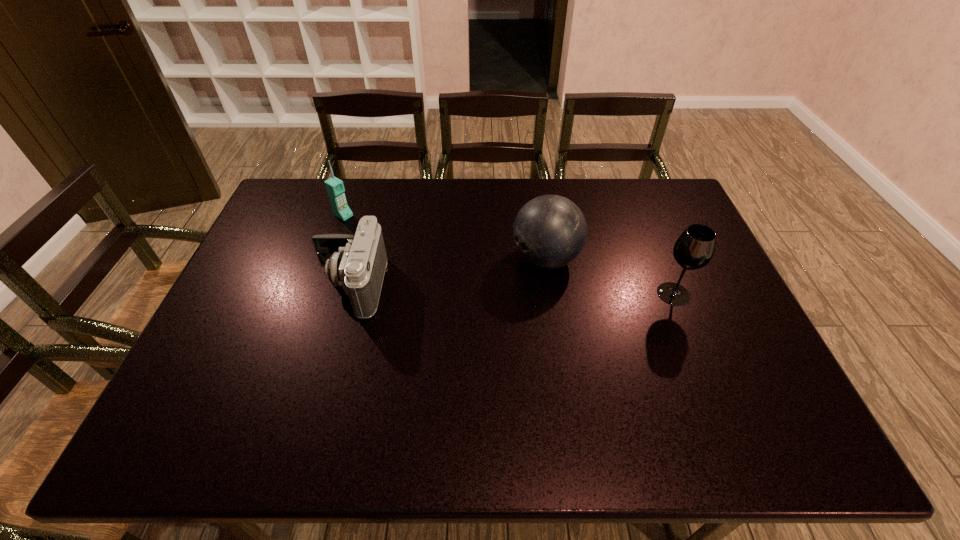
In the image, there is a desktop. Where is `vacant space at the far left corner`? The width and height of the screenshot is (960, 540). vacant space at the far left corner is located at coordinates (293, 211).

In the image, there is a desktop. Find the location of `free space at the near left corner`. free space at the near left corner is located at coordinates (236, 381).

In the image, there is a desktop. Identify the location of vacant space at the far right corner. The image size is (960, 540). (656, 217).

Find the location of a particular element. unoccupied area between the bowling ball and the wineglass is located at coordinates (610, 276).

Where is `free space that is in between the wineglass and the second object from right to left`? free space that is in between the wineglass and the second object from right to left is located at coordinates (610, 276).

Image resolution: width=960 pixels, height=540 pixels. Find the location of `free area in between the bowling ball and the rightmost object`. free area in between the bowling ball and the rightmost object is located at coordinates (610, 276).

In order to click on empty space between the rightmost object and the shortest object in this screenshot , I will do `click(512, 290)`.

Identify the location of unoccupied position between the cellular telephone and the second object from right to left. The image size is (960, 540). (444, 237).

The image size is (960, 540). I want to click on free area in between the third object from left to right and the cellular telephone, so click(x=444, y=237).

The image size is (960, 540). Identify the location of free space between the rightmost object and the farthest object. (509, 255).